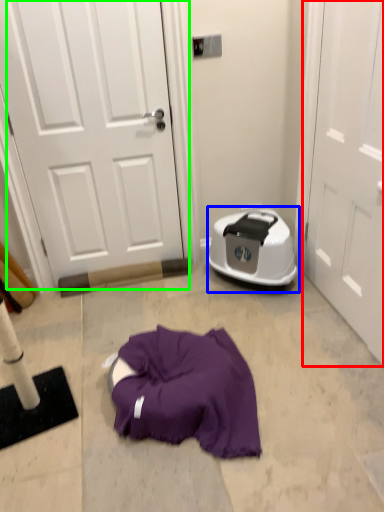
Question: Based on their relative distances, which object is farther from door (highlighted by a red box)? Choose from dish washer (highlighted by a blue box) and door (highlighted by a green box).

Choices:
 (A) dish washer
 (B) door

Answer: (B)